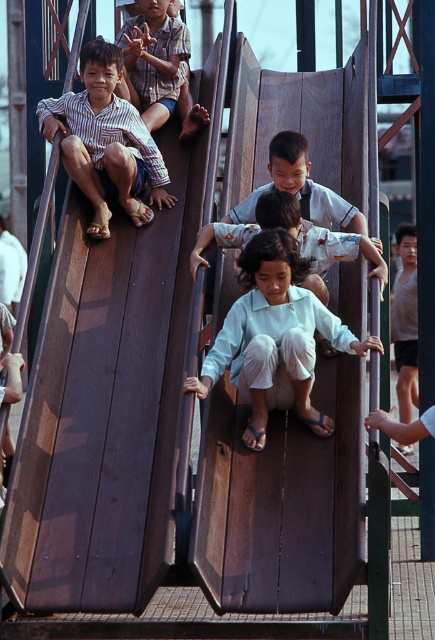
You are a parent observing the playground scene. You notice two items of clothing at the center of the image. The first is the light blue fabric pants at center, and the second is the smooth white shirt at center. Which clothing item is positioned more to the left?

The light blue fabric pants at center is to the left of smooth white shirt at center, so the light blue fabric pants at center is positioned more to the left.

From the picture: You are a parent at the playground and you see two children wearing the matte striped shirt at left and the light blue shirt at center. Which child would you guess is older based on their clothing size?

The matte striped shirt at left has a larger size compared to the light blue shirt at center, so the child wearing the matte striped shirt at left is likely older.